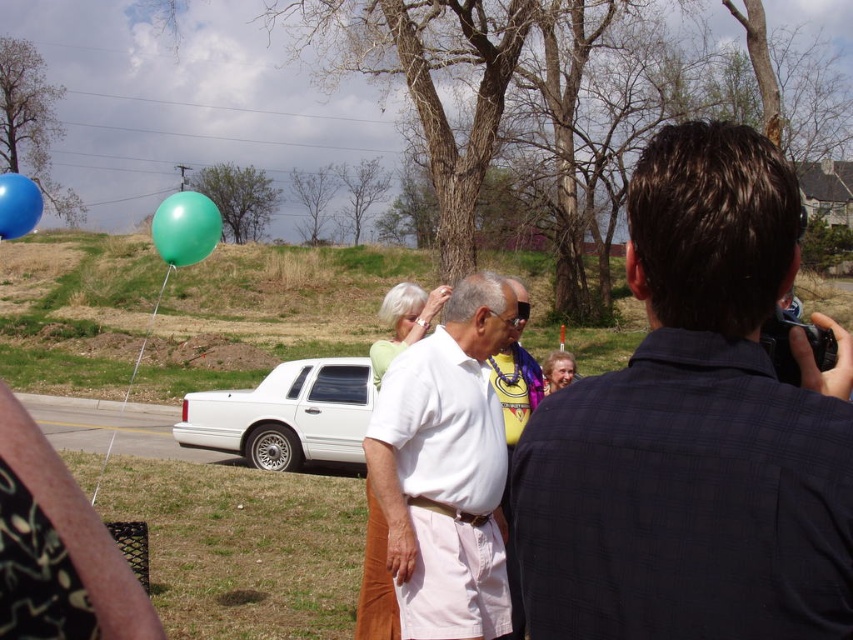
Is green rubber balloon at upper left shorter than shiny blue balloon at upper left?

No.

Can you confirm if green rubber balloon at upper left is thinner than shiny blue balloon at upper left?

Correct, green rubber balloon at upper left's width is less than shiny blue balloon at upper left's.

Is point (175, 202) positioned behind point (26, 189)?

Yes, it is.

Where is `green rubber balloon at upper left`? green rubber balloon at upper left is located at coordinates (184, 227).

Can you confirm if white cotton shirt at center is positioned above white glossy sedan at center?

Indeed, white cotton shirt at center is positioned over white glossy sedan at center.

Does white cotton shirt at center appear on the right side of white glossy sedan at center?

Indeed, white cotton shirt at center is positioned on the right side of white glossy sedan at center.

Who is more forward, (436, 396) or (265, 401)?

Positioned in front is point (436, 396).

At what (x,y) coordinates should I click in order to perform the action: click on white cotton shirt at center. Please return your answer as a coordinate pair (x, y). Looking at the image, I should click on (445, 468).

Is white cotton shirt at center to the right of shiny blue balloon at upper left from the viewer's perspective?

Indeed, white cotton shirt at center is positioned on the right side of shiny blue balloon at upper left.

Is point (386, 522) positioned in front of point (3, 236)?

Yes, it is.

Find the location of a particular element. This screenshot has width=853, height=640. white cotton shirt at center is located at coordinates (445, 468).

You are a GUI agent. You are given a task and a screenshot of the screen. Output one action in this format:
    pyautogui.click(x=<x>, y=<y>)
    Task: Click on the white cotton shirt at center
    
    Given the screenshot: What is the action you would take?
    pyautogui.click(x=445, y=468)